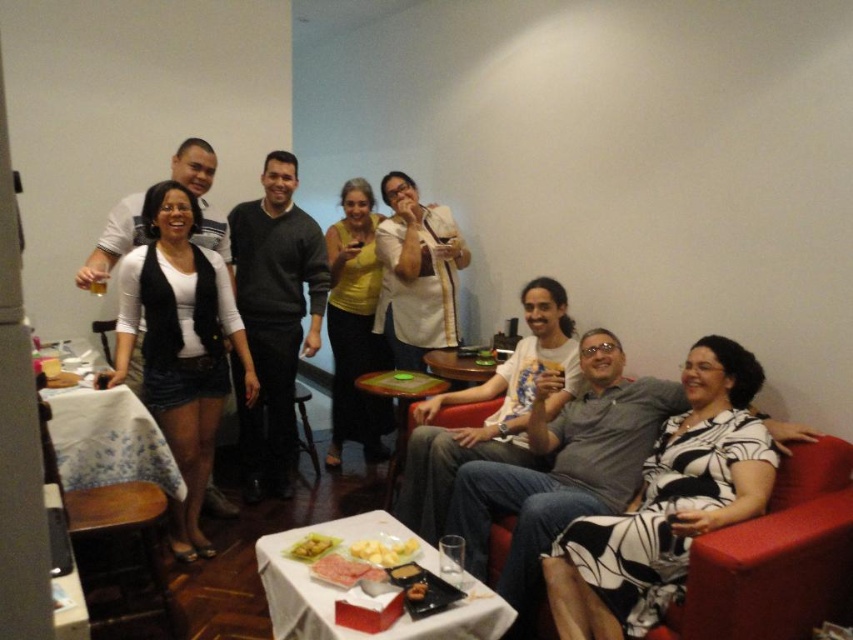
Which is more to the left, matte black couch at center or yellow matte food at center?

From the viewer's perspective, yellow matte food at center appears more on the left side.

Who is shorter, matte black couch at center or yellow matte food at center?

yellow matte food at center is shorter.

Describe the element at coordinates (193, 164) in the screenshot. The image size is (853, 640). I see `matte black couch at center` at that location.

Find the location of a particular element. The height and width of the screenshot is (640, 853). matte black couch at center is located at coordinates (193, 164).

Is yellow matte cheese at center closer to the viewer compared to yellow matte food at center?

Yes, yellow matte cheese at center is in front of yellow matte food at center.

Is point (361, 547) positioned in front of point (299, 552)?

Yes.

At what (x,y) coordinates should I click in order to perform the action: click on yellow matte cheese at center. Please return your answer as a coordinate pair (x, y). Looking at the image, I should click on (384, 550).

Based on the photo, can you confirm if matte black vest at left is positioned to the left of white cotton shirt at center?

Indeed, matte black vest at left is positioned on the left side of white cotton shirt at center.

Does point (184, 476) lie in front of point (428, 349)?

Yes, it is.

Image resolution: width=853 pixels, height=640 pixels. Find the location of `matte black vest at left`. matte black vest at left is located at coordinates (181, 344).